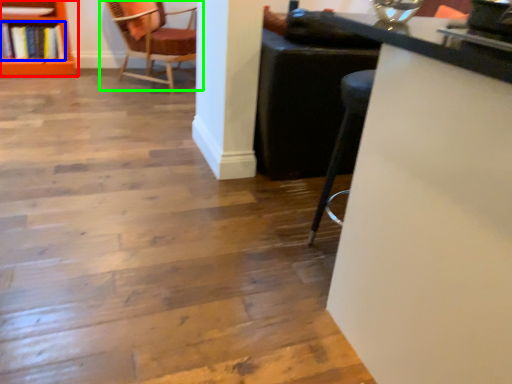
Question: Which object is the closest to the shelf (highlighted by a red box)? Choose among these: book (highlighted by a blue box) or chair (highlighted by a green box).

Choices:
 (A) book
 (B) chair

Answer: (A)